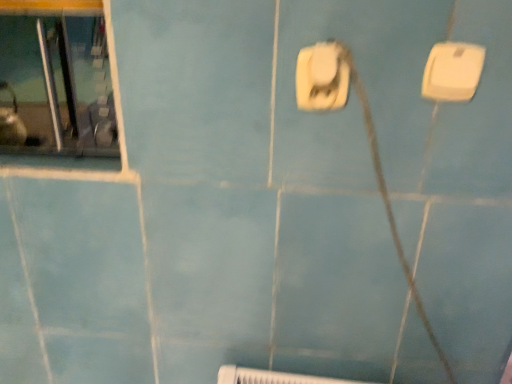
I want to click on white plastic power plug at upper right, so click(x=453, y=71).

What is the approximate width of white plastic power plug at upper right?

It is 0.77 inches.

Image resolution: width=512 pixels, height=384 pixels. What do you see at coordinates (453, 71) in the screenshot?
I see `white plastic power plug at upper right` at bounding box center [453, 71].

Measure the distance between white plastic power plug at upper right and camera.

white plastic power plug at upper right is 24.09 inches away from camera.

This screenshot has width=512, height=384. What are the coordinates of `white plastic power plug at upper right` in the screenshot? It's located at (453, 71).